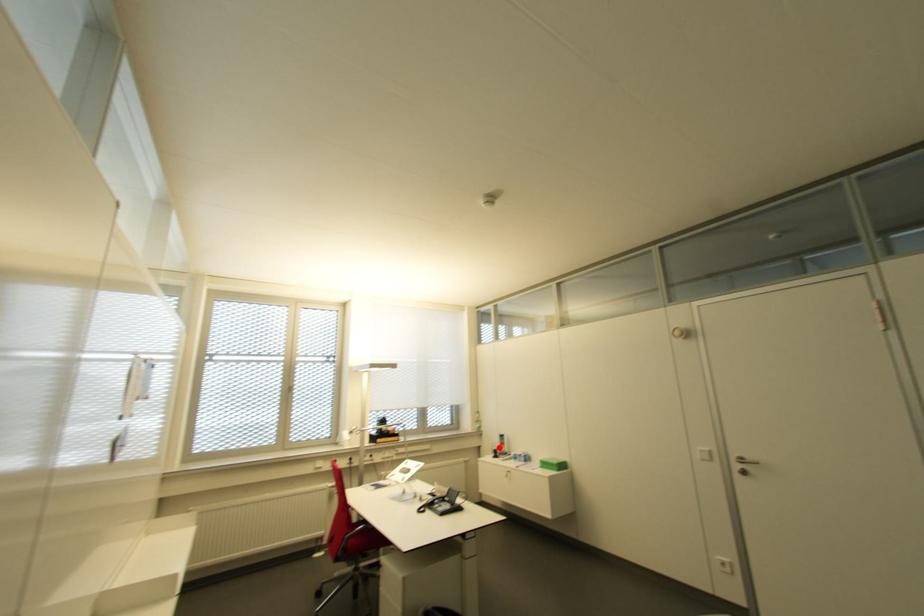
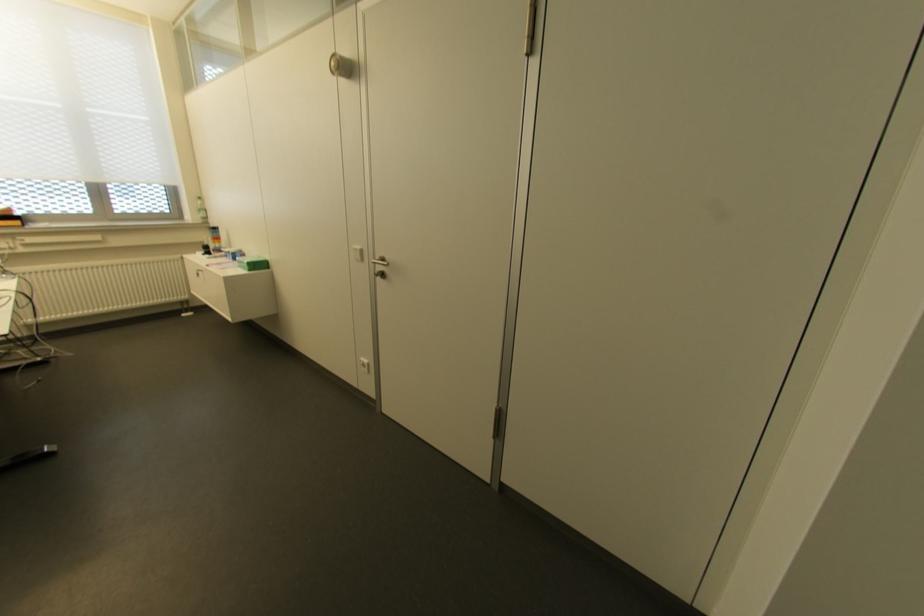
Where in the second image is the point corresponding to the highlighted location from the first image?

(213, 243)